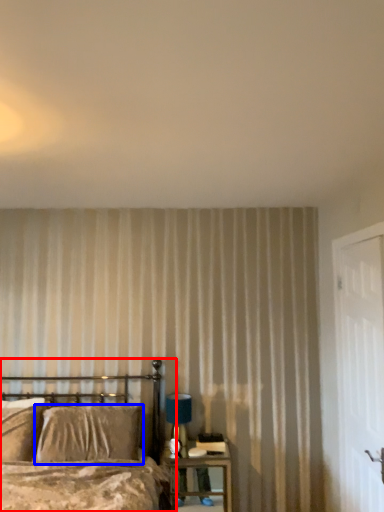
Question: Which point is closer to the camera, bed (highlighted by a red box) or pillow (highlighted by a blue box)?

Choices:
 (A) bed
 (B) pillow

Answer: (A)